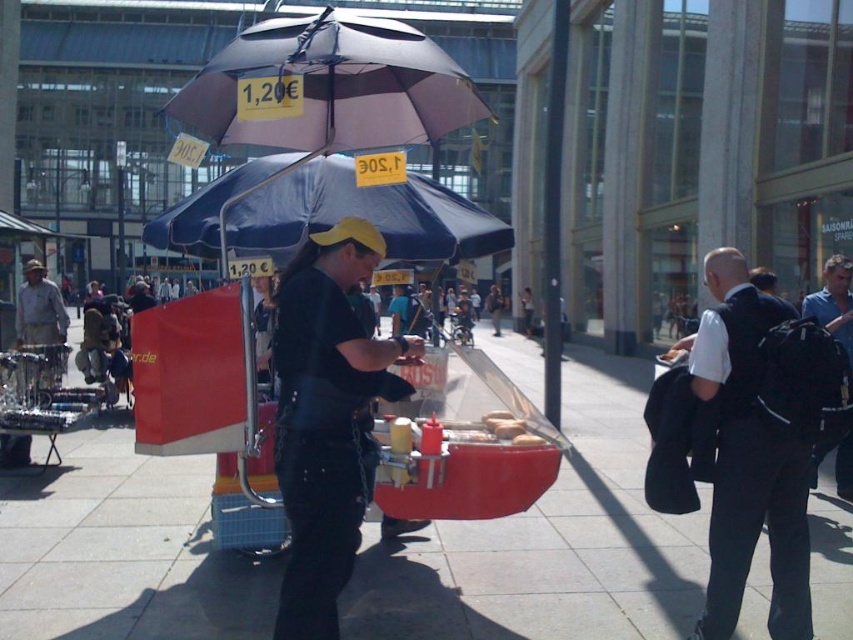
Is smooth red cart at center thinner than matte black umbrella at upper center?

Incorrect, smooth red cart at center's width is not less than matte black umbrella at upper center's.

Between point (148, 493) and point (271, 72), which one is positioned in front?

Positioned in front is point (271, 72).

What are the coordinates of `smooth red cart at center` in the screenshot? It's located at (549, 545).

Is point (160, 465) positioned behind point (352, 260)?

Yes, it is.

Who is positioned more to the right, smooth red cart at center or black leather jacket at center?

From the viewer's perspective, black leather jacket at center appears more on the right side.

Between point (547, 554) and point (312, 387), which one is positioned in front?

Point (312, 387) is in front.

Where is `smooth red cart at center`? The width and height of the screenshot is (853, 640). smooth red cart at center is located at coordinates (549, 545).

Does point (340, 417) come closer to viewer compared to point (753, 444)?

Yes, it is in front of point (753, 444).

Who is more forward, (322, 420) or (727, 440)?

Point (322, 420) is more forward.

Locate an element on the screen. The image size is (853, 640). black leather jacket at center is located at coordinates (326, 417).